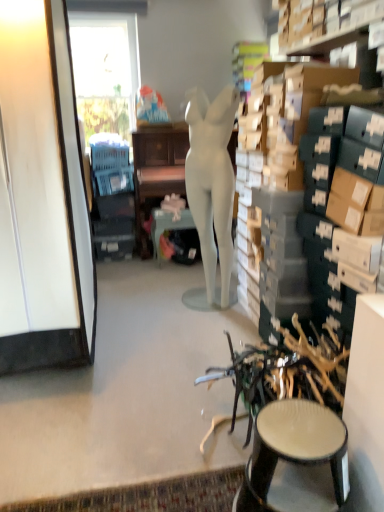
Question: Visually, is matte white mannequin at center positioned to the left or to the right of metallic teal table at center?

Choices:
 (A) right
 (B) left

Answer: (A)

Question: From the image's perspective, is matte white mannequin at center above or below metallic teal table at center?

Choices:
 (A) above
 (B) below

Answer: (A)

Question: Based on their relative distances, which object is nearer to the white glossy cabinet at left?

Choices:
 (A) matte black stool at lower right
 (B) blue plastic swivel chair at left
 (C) matte white desk at center
 (D) matte white mannequin at center
 (E) metallic teal table at center

Answer: (D)

Question: Which is nearer to the white glossy cabinet at left?

Choices:
 (A) metallic teal table at center
 (B) matte black stool at lower right
 (C) blue plastic swivel chair at left
 (D) matte white desk at center
 (E) matte white mannequin at center

Answer: (E)